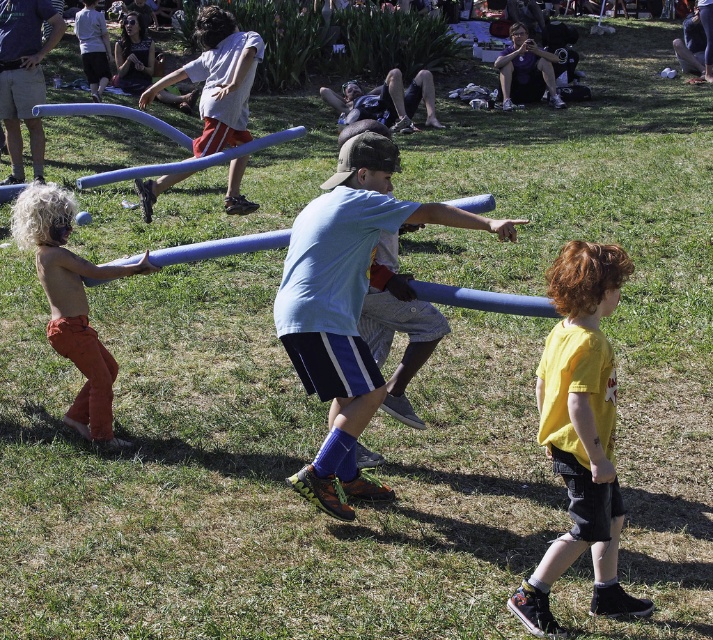
You are a photographer taking a picture of the light blue fabric shirt at center and the matte blue pole at upper left. Which object should you focus on first to ensure both are in sharp focus?

You should focus on the light blue fabric shirt at center first because it is closer to the viewer than the matte blue pole at upper left, so starting with the closer object ensures both will be in focus when using depth of field techniques.

In the scene with the blue plastic tubes, there are two children wearing yellow matte shirt at right and matte black shirt at upper center. Which child is positioned more to the left?

The yellow matte shirt at right is positioned more to the left than the matte black shirt at upper center.